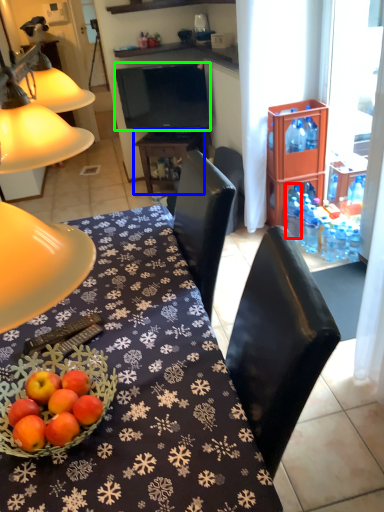
Question: Considering the real-world distances, which object is farthest from bottle (highlighted by a red box)? table (highlighted by a blue box) or television (highlighted by a green box)?

Choices:
 (A) table
 (B) television

Answer: (B)